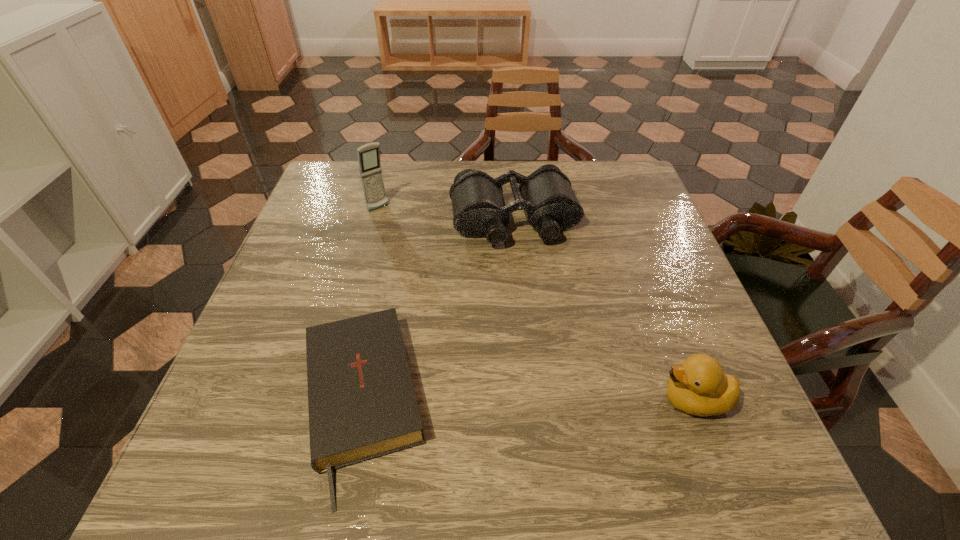
You are a GUI agent. You are given a task and a screenshot of the screen. Output one action in this format:
    pyautogui.click(x=<x>, y=<y>)
    Task: Click on the vacant space that is in between the tallest object and the shortest object
    The height and width of the screenshot is (540, 960).
    Given the screenshot: What is the action you would take?
    pyautogui.click(x=370, y=306)

The height and width of the screenshot is (540, 960). Find the location of `vacant region between the rightmost object and the second object from right to left`. vacant region between the rightmost object and the second object from right to left is located at coordinates (604, 310).

This screenshot has height=540, width=960. Find the location of `unoccupied area between the second object from right to left and the shortest object`. unoccupied area between the second object from right to left and the shortest object is located at coordinates (437, 312).

Where is `blank region between the second object from right to left and the Bible`? The width and height of the screenshot is (960, 540). blank region between the second object from right to left and the Bible is located at coordinates (437, 312).

The image size is (960, 540). In order to click on vacant region between the third object from left to right and the shortest object in this screenshot , I will do `click(437, 312)`.

Locate an element on the screen. The height and width of the screenshot is (540, 960). unoccupied area between the shortest object and the cellular telephone is located at coordinates (370, 306).

Image resolution: width=960 pixels, height=540 pixels. Identify the location of free space between the Bible and the cellular telephone. (370, 306).

You are a GUI agent. You are given a task and a screenshot of the screen. Output one action in this format:
    pyautogui.click(x=<x>, y=<y>)
    Task: Click on the vacant area that lies between the shortest object and the duckling
    The height and width of the screenshot is (540, 960).
    Given the screenshot: What is the action you would take?
    pyautogui.click(x=527, y=402)

Identify which object is the third nearest to the third object from left to right. Please provide its 2D coordinates. Your answer should be formatted as a tuple, i.e. [(x, y)], where the tuple contains the x and y coordinates of a point satisfying the conditions above.

[(698, 386)]

Identify the location of object identified as the second closest to the binoculars. This screenshot has width=960, height=540. (362, 405).